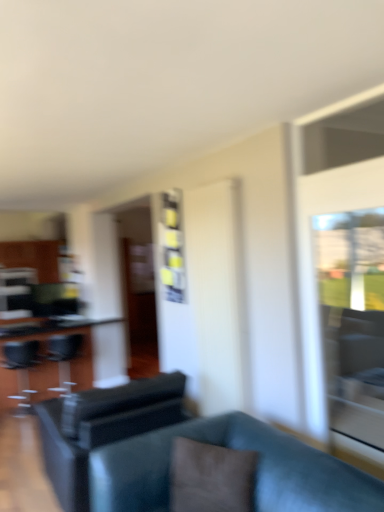
The height and width of the screenshot is (512, 384). What do you see at coordinates (47, 360) in the screenshot?
I see `black glass table at left` at bounding box center [47, 360].

Measure the distance between brown fabric pillow at center and camera.

They are 1.98 meters apart.

Where is `brown fabric pillow at center`? The width and height of the screenshot is (384, 512). brown fabric pillow at center is located at coordinates (210, 477).

The height and width of the screenshot is (512, 384). Identify the location of matte black swivel chair at left, which is the second swivel chair in left-to-right order. (63, 358).

Describe the element at coordinates (63, 358) in the screenshot. This screenshot has width=384, height=512. I see `matte black swivel chair at left, the second swivel chair from the right` at that location.

Describe the element at coordinates (353, 320) in the screenshot. I see `transparent glass door at right` at that location.

The image size is (384, 512). I want to click on black leather swivel chair at left, the 2th swivel chair in the back-to-front sequence, so click(21, 369).

Does brown fabric pillow at center come behind black leather swivel chair at center, which is the first swivel chair in right-to-left order?

No, it is not.

Looking at the image, does brown fabric pillow at center seem bigger or smaller compared to black leather swivel chair at center, the 3th swivel chair when ordered from left to right?

In the image, brown fabric pillow at center appears to be smaller than black leather swivel chair at center, the 3th swivel chair when ordered from left to right.

Would you say brown fabric pillow at center is inside or outside black leather swivel chair at center, the 3th swivel chair when ordered from left to right?

brown fabric pillow at center is located beyond the bounds of black leather swivel chair at center, the 3th swivel chair when ordered from left to right.

From the image's perspective, count 1st swivel chairs downward from the brown fabric pillow at center and point to it. Please provide its 2D coordinates.

[(102, 426)]

Between brown fabric pillow at center and transparent glass door at right, which one has less height?

brown fabric pillow at center.

Is brown fabric pillow at center looking in the opposite direction of transparent glass door at right?

No, transparent glass door at right is not at the back of brown fabric pillow at center.

Considering the relative positions of brown fabric pillow at center and transparent glass door at right in the image provided, is brown fabric pillow at center to the left of transparent glass door at right from the viewer's perspective?

Yes.

In the scene shown: Considering the relative sizes of brown fabric pillow at center and transparent glass door at right in the image provided, is brown fabric pillow at center smaller than transparent glass door at right?

No, brown fabric pillow at center is not smaller than transparent glass door at right.

From a real-world perspective, is leather couch at center above or below black glass table at left?

leather couch at center is below black glass table at left.

In the scene shown: Is black glass table at left located within leather couch at center?

Definitely not — black glass table at left is not inside leather couch at center.

Considering the relative sizes of leather couch at center and black leather swivel chair at center, the 3th swivel chair when ordered from left to right, in the image provided, is leather couch at center thinner than black leather swivel chair at center, the 3th swivel chair when ordered from left to right,?

Yes.

Which swivel chair is the 1st one when counting from the left side of the leather couch at center? Please provide its 2D coordinates.

[(102, 426)]

From a real-world perspective, which is physically above, leather couch at center or black leather swivel chair at center, the 3th swivel chair when ordered from left to right?

In real-world perspective, black leather swivel chair at center, the 3th swivel chair when ordered from left to right, is above.

Does leather couch at center have a lesser height compared to black leather swivel chair at center, which is the first swivel chair in right-to-left order?

Yes, leather couch at center is shorter than black leather swivel chair at center, which is the first swivel chair in right-to-left order.

There is a black leather swivel chair at center, which is the first swivel chair in right-to-left order. Identify the location of glass door above it (from a real-world perspective). The image size is (384, 512). (353, 320).

Between point (162, 400) and point (371, 314), which one is positioned in front?

Positioned in front is point (162, 400).

From the image's perspective, would you say black leather swivel chair at center, acting as the third swivel chair starting from the back, is shown under transparent glass door at right?

Yes, from the image's perspective, black leather swivel chair at center, acting as the third swivel chair starting from the back, is below transparent glass door at right.

Which is behind, black leather swivel chair at center, the 3th swivel chair when ordered from left to right, or transparent glass door at right?

black leather swivel chair at center, the 3th swivel chair when ordered from left to right.

Considering the positions of point (20, 362) and point (240, 457), is point (20, 362) closer or farther from the camera than point (240, 457)?

Point (20, 362) is farther from the camera than point (240, 457).

Looking at this image, is black leather swivel chair at left, marked as the 1th swivel chair in a left-to-right arrangement, facing away from brown fabric pillow at center?

Absolutely, black leather swivel chair at left, marked as the 1th swivel chair in a left-to-right arrangement, is directed away from brown fabric pillow at center.

From a real-world perspective, which is physically below, black leather swivel chair at left, the 2th swivel chair in the back-to-front sequence, or brown fabric pillow at center?

In real-world perspective, black leather swivel chair at left, the 2th swivel chair in the back-to-front sequence, is lower.

Considering the relative positions of brown fabric pillow at center and matte black swivel chair at left, which is the second swivel chair in left-to-right order, in the image provided, is brown fabric pillow at center to the left of matte black swivel chair at left, which is the second swivel chair in left-to-right order, from the viewer's perspective?

No, brown fabric pillow at center is not to the left of matte black swivel chair at left, which is the second swivel chair in left-to-right order.

Between point (194, 505) and point (76, 347), which one is positioned in front?

The point (194, 505) is in front.

Considering the relative sizes of brown fabric pillow at center and matte black swivel chair at left, marked as the 1th swivel chair in a back-to-front arrangement, in the image provided, is brown fabric pillow at center thinner than matte black swivel chair at left, marked as the 1th swivel chair in a back-to-front arrangement,?

Yes, brown fabric pillow at center is thinner than matte black swivel chair at left, marked as the 1th swivel chair in a back-to-front arrangement.

The image size is (384, 512). Identify the location of pillow lying in front of the matte black swivel chair at left, which is the second swivel chair in left-to-right order. (210, 477).

From a real-world perspective, which swivel chair is the 1st one underneath the brown fabric pillow at center? Please provide its 2D coordinates.

[(102, 426)]

This screenshot has height=512, width=384. What are the coordinates of `glass door above the brown fabric pillow at center (from a real-world perspective)` in the screenshot? It's located at (353, 320).

Estimate the real-world distances between objects in this image. Which object is closer to black glass table at left, transparent glass door at right or black leather swivel chair at center, the 3th swivel chair when ordered from left to right?

black leather swivel chair at center, the 3th swivel chair when ordered from left to right, is closer to black glass table at left.

Looking at the image, which one is located further to black leather swivel chair at left, marked as the 1th swivel chair in a left-to-right arrangement, transparent glass door at right or leather couch at center?

The object further to black leather swivel chair at left, marked as the 1th swivel chair in a left-to-right arrangement, is transparent glass door at right.

Based on their spatial positions, is leather couch at center or black leather swivel chair at center, which is the first swivel chair in right-to-left order, further from matte black swivel chair at left, the second swivel chair from the right?

leather couch at center.

Which object lies further to the anchor point matte black swivel chair at left, the second swivel chair from the right, black leather swivel chair at center, which is the first swivel chair in right-to-left order, or black glass table at left?

black leather swivel chair at center, which is the first swivel chair in right-to-left order, is positioned further to the anchor matte black swivel chair at left, the second swivel chair from the right.

From the image, which object appears to be farther from black leather swivel chair at center, the 3th swivel chair when ordered from left to right, matte black swivel chair at left, the second swivel chair from the right, or black glass table at left?

matte black swivel chair at left, the second swivel chair from the right, is positioned further to the anchor black leather swivel chair at center, the 3th swivel chair when ordered from left to right.

Estimate the real-world distances between objects in this image. Which object is closer to matte black swivel chair at left, the third swivel chair positioned from the front, brown fabric pillow at center or black glass table at left?

black glass table at left lies closer to matte black swivel chair at left, the third swivel chair positioned from the front, than the other object.

From the image, which object appears to be farther from matte black swivel chair at left, marked as the 1th swivel chair in a back-to-front arrangement, black leather swivel chair at center, arranged as the first swivel chair when viewed from the front, or transparent glass door at right?

transparent glass door at right.

In the scene shown: Considering their positions, is transparent glass door at right positioned closer to black leather swivel chair at center, which is the first swivel chair in right-to-left order, than leather couch at center?

leather couch at center.

Locate an element on the screen. The width and height of the screenshot is (384, 512). glass door located between leather couch at center and black glass table at left in the depth direction is located at coordinates (353, 320).

Image resolution: width=384 pixels, height=512 pixels. What are the coordinates of `glass door between brown fabric pillow at center and black glass table at left in the front-back direction` in the screenshot? It's located at (353, 320).

Locate an element on the screen. swivel chair between transparent glass door at right and black leather swivel chair at left, marked as the 1th swivel chair in a left-to-right arrangement, along the z-axis is located at coordinates (102, 426).

Locate an element on the screen. The image size is (384, 512). pillow between leather couch at center and transparent glass door at right along the z-axis is located at coordinates (210, 477).